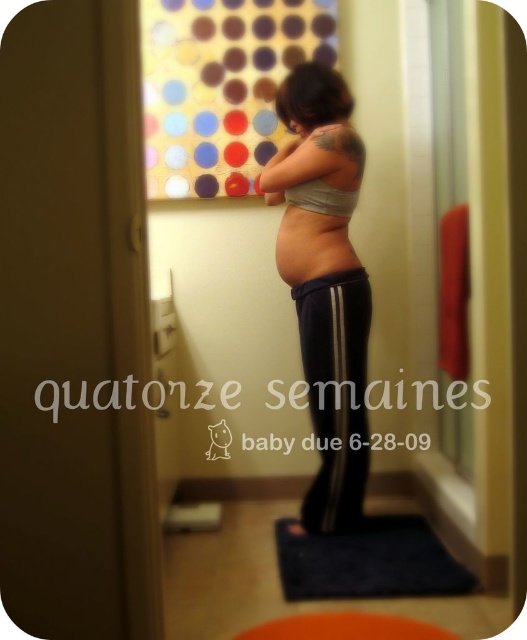
You are a physical therapist instructing a pregnant woman on safe exercise positions. You need to place a yoga mat in the bathroom where she can safely perform exercises. The bathroom has a toilet with a closed lid and a red towel on the right. Where should you position the blue soft mat at lower center so that it doesn not interfere with the toilet or the red towel?

The blue soft mat at lower center should be placed at the coordinates point (368, 561) to avoid interfering with the toilet or the red towel.

You are a fashion designer observing the image of a pregnant woman in a bathroom. You need to determine the spatial arrangement of her clothing items. Based on the scene, which item is positioned higher on her body between the gray matte fabric at center and the navy blue track pants at center?

The gray matte fabric at center is located above the navy blue track pants at center, meaning the gray matte fabric at center is positioned higher on her body.